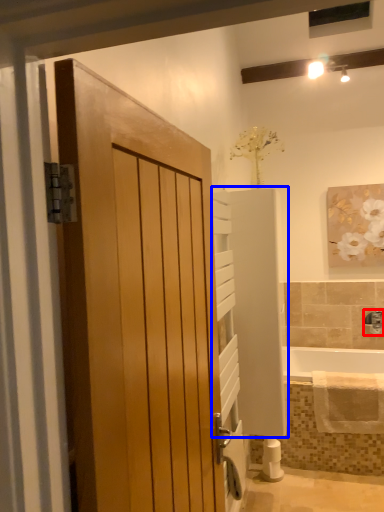
Question: Which object is further to the camera taking this photo, tap (highlighted by a red box) or elevator (highlighted by a blue box)?

Choices:
 (A) tap
 (B) elevator

Answer: (A)